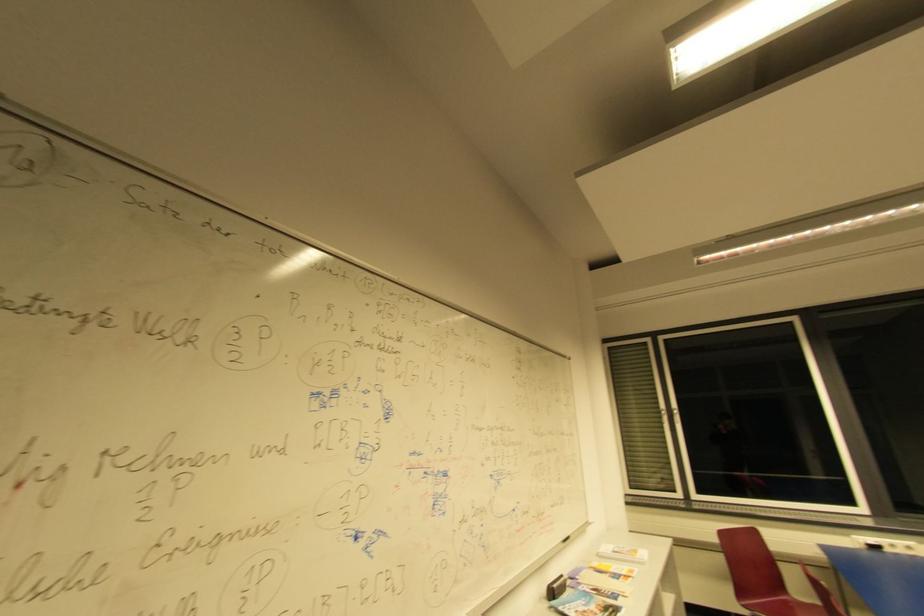
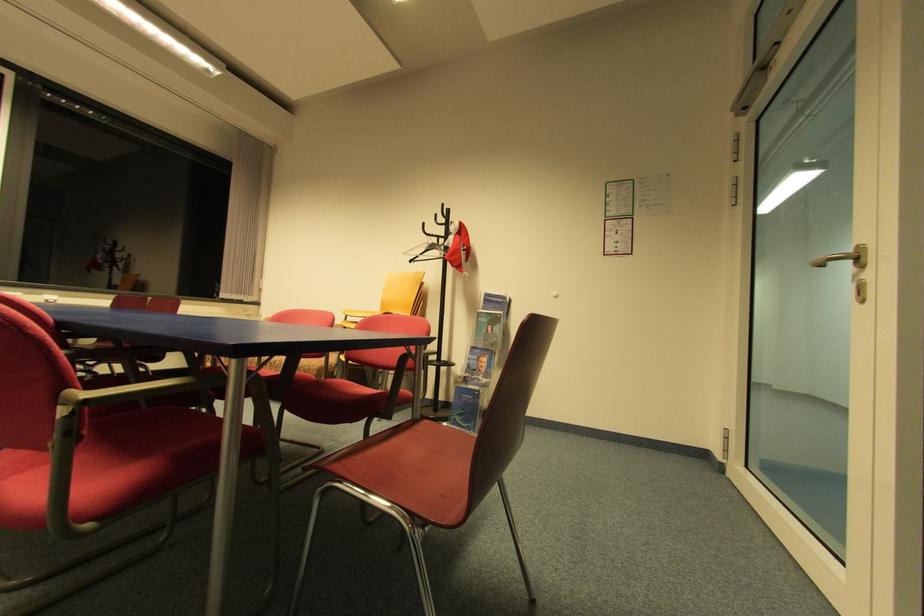
Question: The images are taken continuously from a first-person perspective. In which direction is your viewpoint rotating?

Choices:
 (A) Left
 (B) Right
 (C) Up
 (D) Down

Answer: (B)